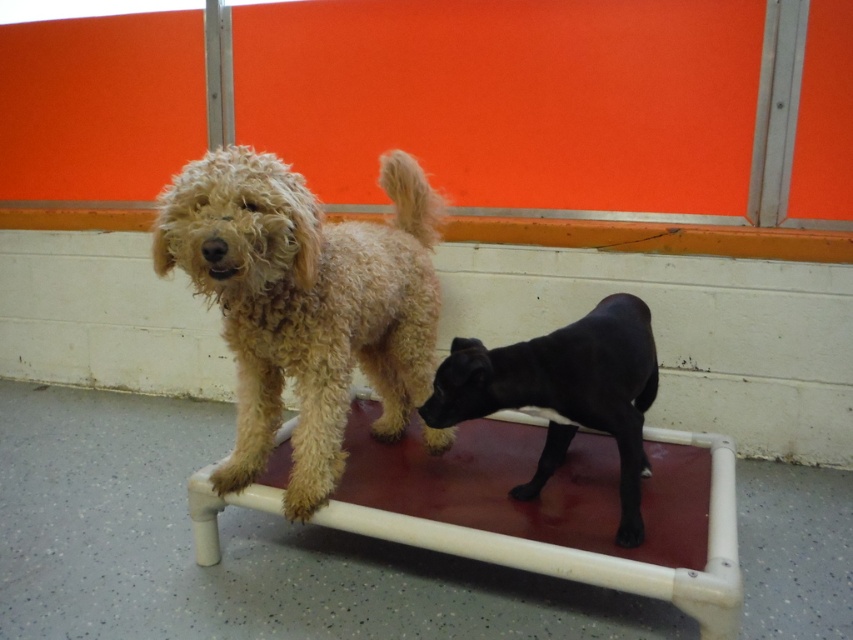
Question: Can you confirm if curly beige dog at center is thinner than black smooth dog at center?

Choices:
 (A) yes
 (B) no

Answer: (A)

Question: Which object is farther from the camera taking this photo?

Choices:
 (A) black smooth dog at center
 (B) curly beige dog at center

Answer: (A)

Question: Is curly beige dog at center positioned behind black smooth dog at center?

Choices:
 (A) yes
 (B) no

Answer: (B)

Question: Is curly beige dog at center positioned in front of black smooth dog at center?

Choices:
 (A) no
 (B) yes

Answer: (B)

Question: Which point is closer to the camera taking this photo?

Choices:
 (A) (454, 349)
 (B) (259, 394)

Answer: (A)